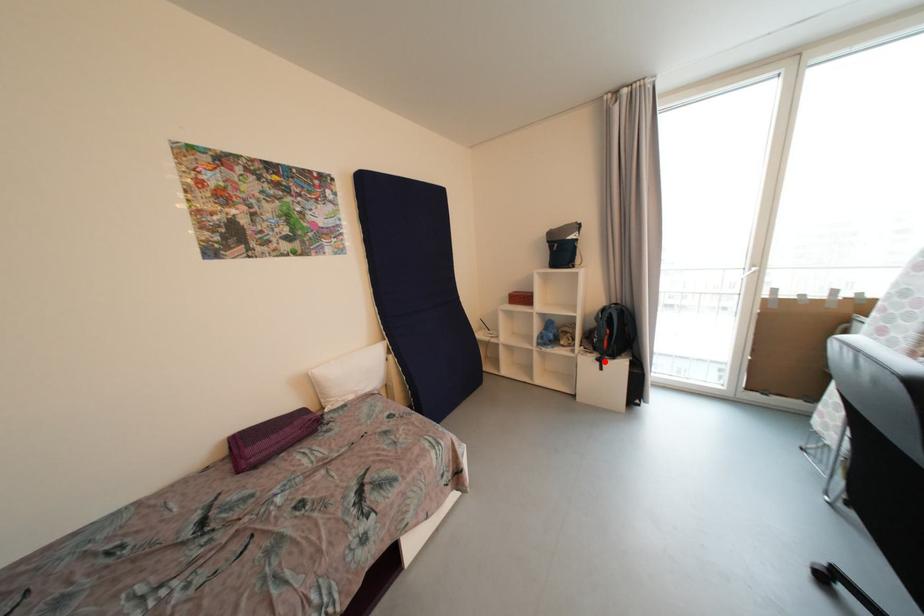
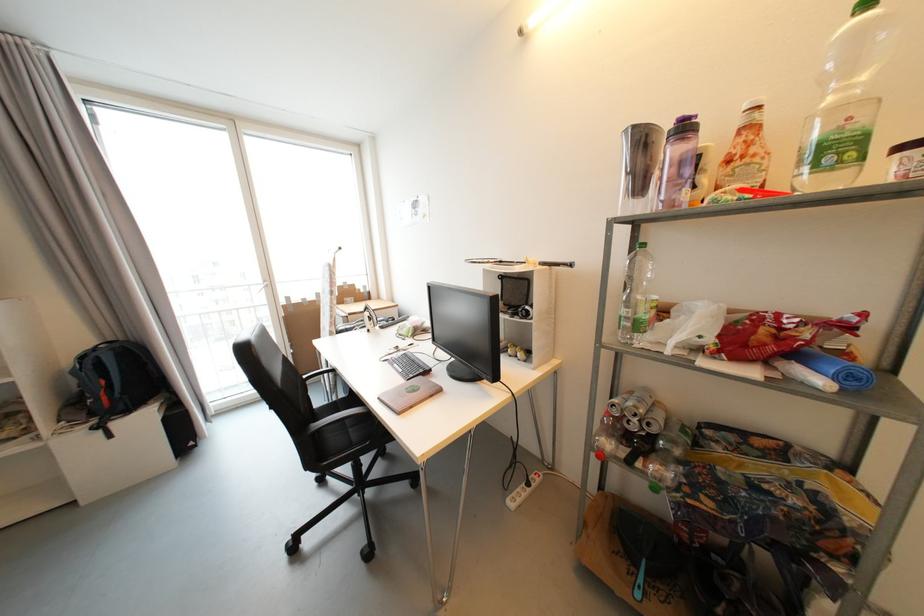
Find the pixel in the second image that matches the highlighted location in the first image.

(104, 429)